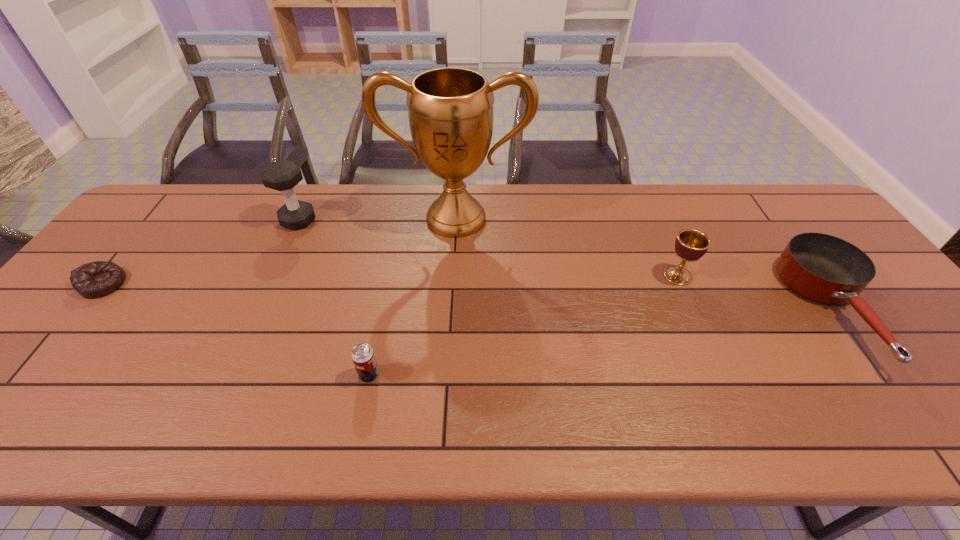
The height and width of the screenshot is (540, 960). I want to click on blank space at the near edge of the desktop, so click(x=496, y=415).

The image size is (960, 540). In the image, there is a desktop. What are the coordinates of `free space at the left edge` in the screenshot? It's located at (52, 370).

In the image, there is a desktop. In order to click on vacant region at the far right corner in this screenshot , I will do `click(783, 207)`.

You are a GUI agent. You are given a task and a screenshot of the screen. Output one action in this format:
    pyautogui.click(x=<x>, y=<y>)
    Task: Click on the free space between the rightmost object and the beanbag
    This screenshot has width=960, height=540.
    Given the screenshot: What is the action you would take?
    pyautogui.click(x=469, y=296)

At what (x,y) coordinates should I click in order to perform the action: click on free space between the beer can and the third tallest object. Please return your answer as a coordinate pair (x, y). The width and height of the screenshot is (960, 540). Looking at the image, I should click on (523, 325).

You are a GUI agent. You are given a task and a screenshot of the screen. Output one action in this format:
    pyautogui.click(x=<x>, y=<y>)
    Task: Click on the free space between the leftmost object and the tallest object
    The image size is (960, 540).
    Given the screenshot: What is the action you would take?
    pyautogui.click(x=279, y=251)

Where is `empty space that is in between the trophy cup and the chalice`? The height and width of the screenshot is (540, 960). empty space that is in between the trophy cup and the chalice is located at coordinates (567, 247).

The width and height of the screenshot is (960, 540). Identify the location of vacant space that's between the beanbag and the trophy cup. (279, 251).

This screenshot has width=960, height=540. I want to click on vacant space in between the dumbbell and the beer can, so click(x=334, y=298).

This screenshot has height=540, width=960. In order to click on free space between the pan and the trophy cup in this screenshot , I will do `click(646, 264)`.